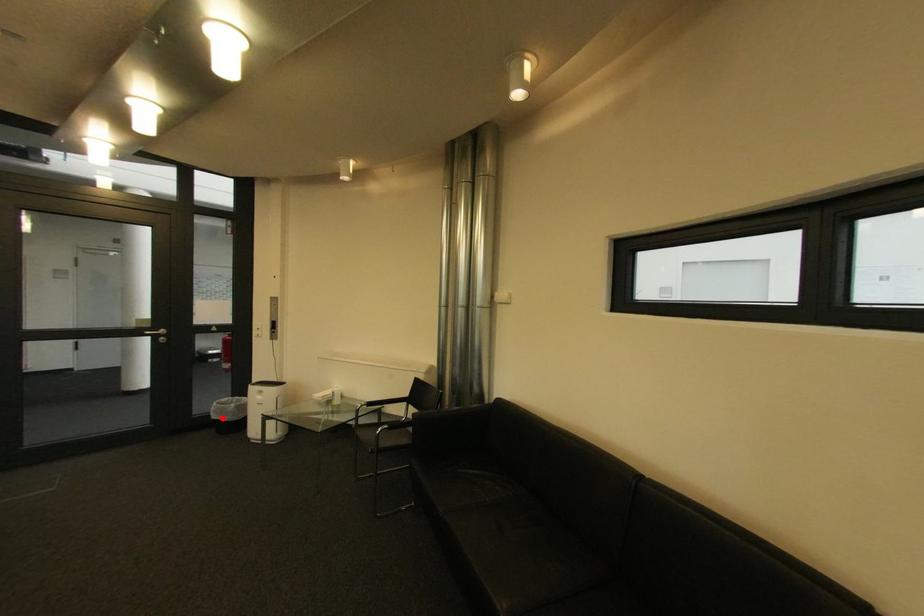
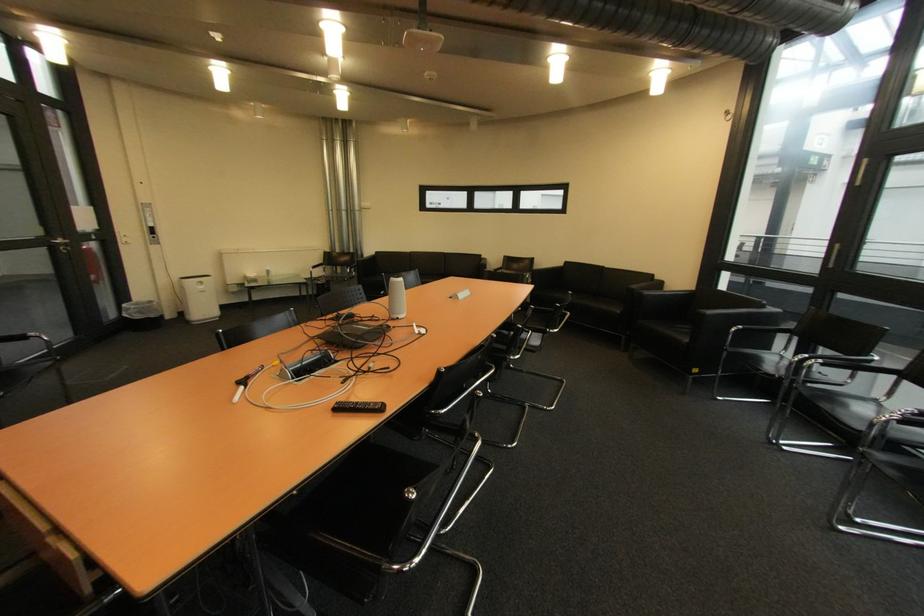
Question: I am providing you with two images of the same scene from different viewpoints. In image1, a red point is highlighted. Considering the same 3D point in image2, which of the following is correct?

Choices:
 (A) It is closer
 (B) It is farther

Answer: (A)